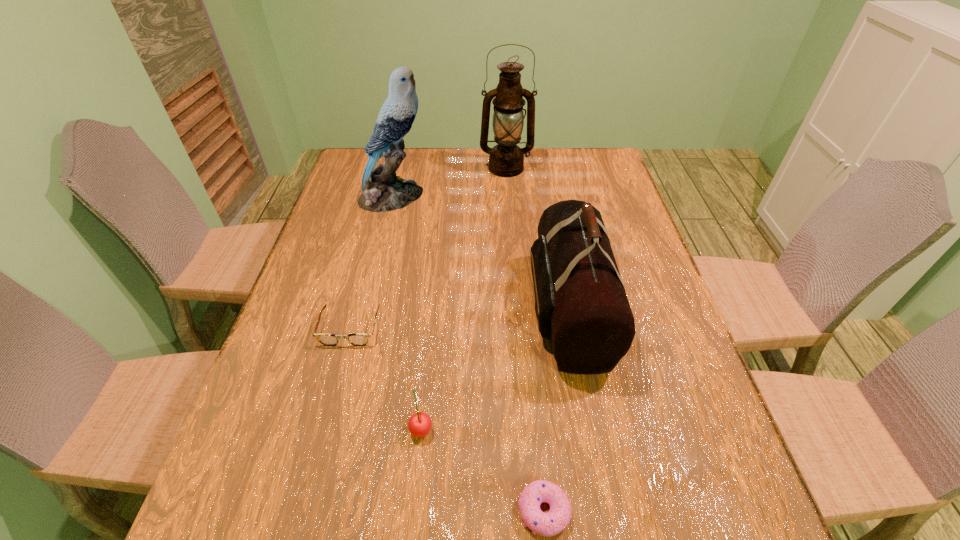
What are the coordinates of `object positioned at the right edge` in the screenshot? It's located at (581, 305).

This screenshot has height=540, width=960. In order to click on object that is at the far left corner in this screenshot , I will do `click(382, 191)`.

Locate an element on the screen. This screenshot has width=960, height=540. free space at the far edge of the desktop is located at coordinates (435, 167).

The image size is (960, 540). Find the location of `vacant space at the near edge`. vacant space at the near edge is located at coordinates pyautogui.click(x=461, y=530).

Find the location of a particular element. The height and width of the screenshot is (540, 960). vacant space at the left edge of the desktop is located at coordinates (297, 468).

At what (x,y) coordinates should I click in order to perform the action: click on vacant space at the right edge of the desktop. Please return your answer as a coordinate pair (x, y). The height and width of the screenshot is (540, 960). Looking at the image, I should click on (650, 466).

The image size is (960, 540). Find the location of `free space at the far right corner of the desktop`. free space at the far right corner of the desktop is located at coordinates (610, 168).

Where is `free space that is in between the nearest object and the farthest object`? This screenshot has height=540, width=960. free space that is in between the nearest object and the farthest object is located at coordinates (525, 340).

At what (x,y) coordinates should I click in order to perform the action: click on free space between the third shortest object and the oil lamp. Please return your answer as a coordinate pair (x, y). The height and width of the screenshot is (540, 960). Looking at the image, I should click on (464, 298).

Identify the location of vacant area that lies between the fourth shortest object and the parakeet. The width and height of the screenshot is (960, 540). pos(481,253).